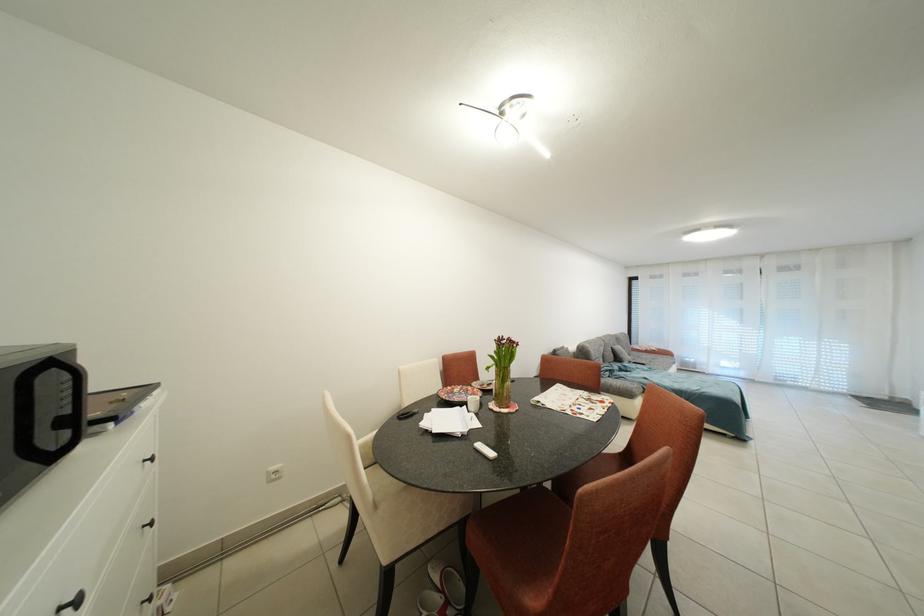
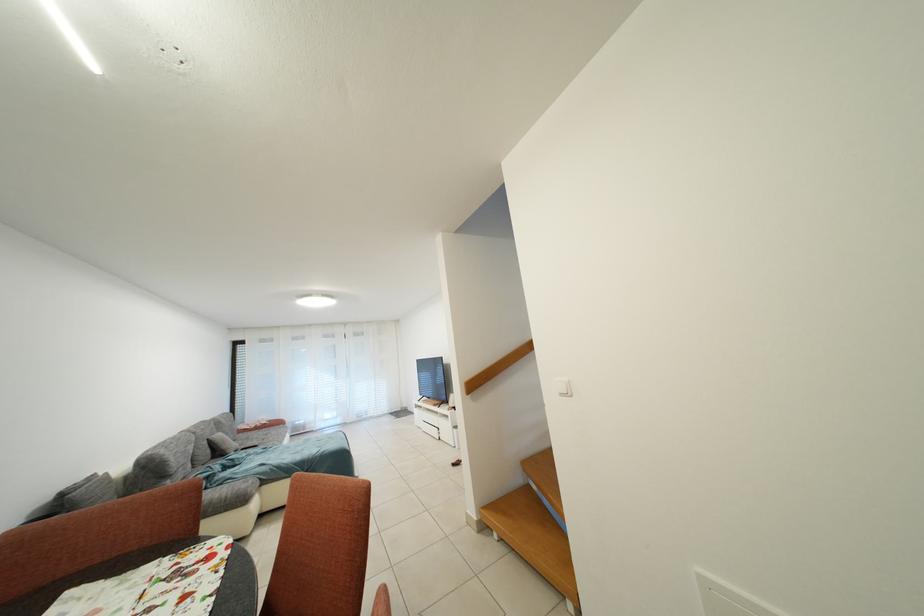
Question: Based on the continuous images, in which direction is the camera rotating? Reply with the corresponding letter.

Choices:
 (A) Left
 (B) Right
 (C) Up
 (D) Down

Answer: (B)